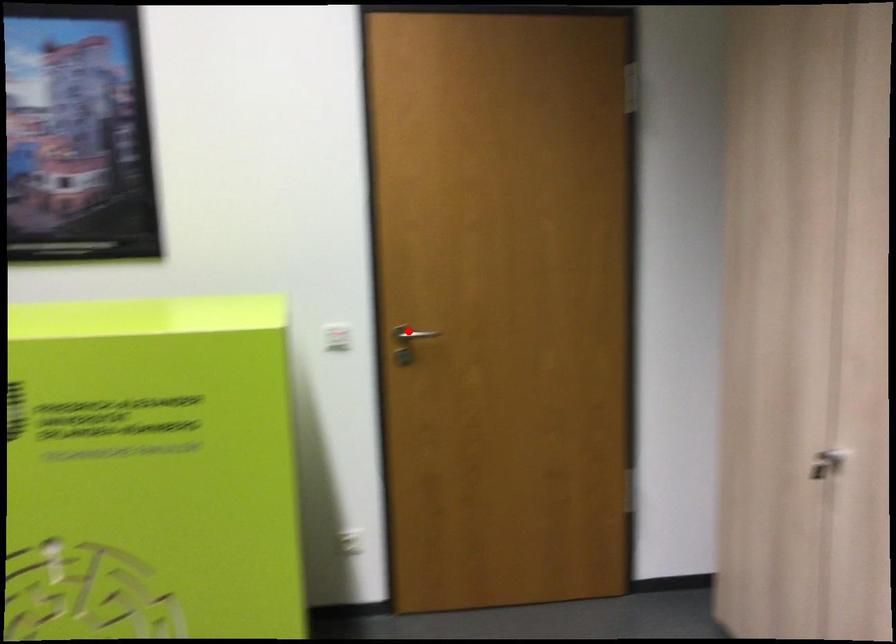
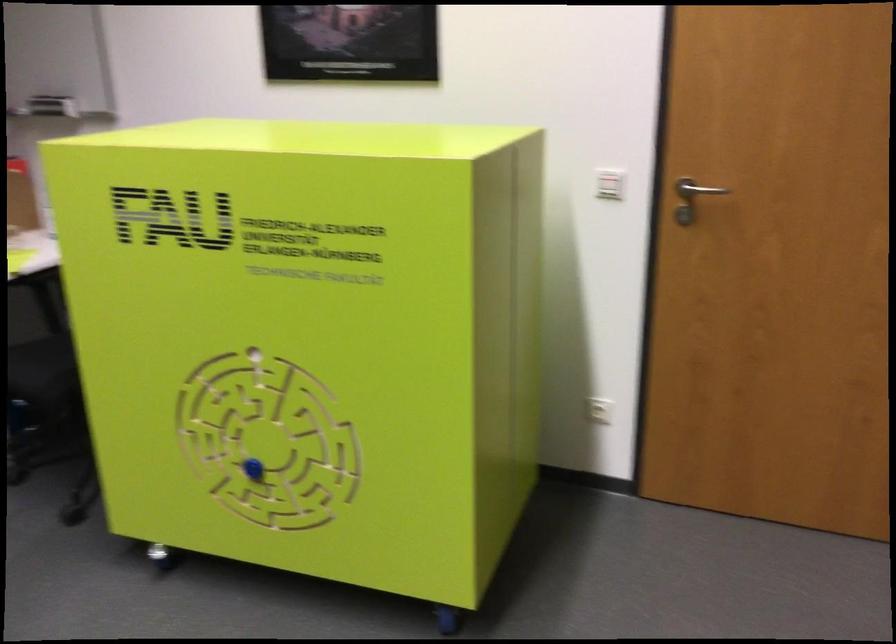
The point at the highlighted location is marked in the first image. Where is the corresponding point in the second image?

(694, 190)